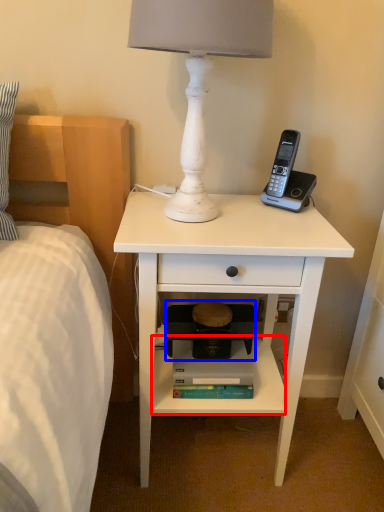
Question: Which object is closer to the camera taking this photo, shelf (highlighted by a red box) or step stool (highlighted by a blue box)?

Choices:
 (A) shelf
 (B) step stool

Answer: (A)